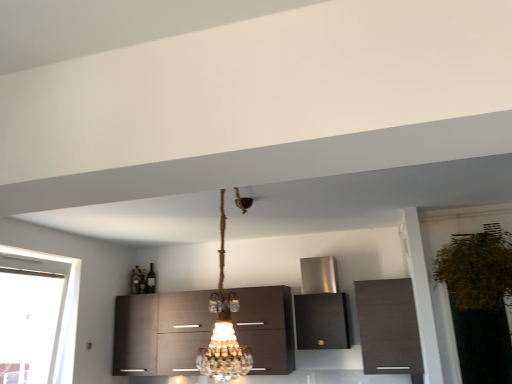
Question: Considering their positions, is clear glass window at left located in front of or behind crystal glass chandelier at center?

Choices:
 (A) behind
 (B) front

Answer: (A)

Question: From a real-world perspective, is clear glass window at left positioned above or below crystal glass chandelier at center?

Choices:
 (A) above
 (B) below

Answer: (B)

Question: Estimate the real-world distances between objects in this image. Which object is farther from the dark wood cabinet at center, marked as the third cabinetry in a right-to-left arrangement?

Choices:
 (A) stainless steel range hood at center, positioned as the 2th cabinetry in left-to-right order
 (B) green leafy plant at right
 (C) clear glass window at left
 (D) matte brown cabinet at upper right, the first cabinetry positioned from the right
 (E) crystal glass chandelier at center

Answer: (B)

Question: Considering the real-world distances, which object is farthest from the matte brown cabinet at upper right, the first cabinetry positioned from the right?

Choices:
 (A) clear glass window at left
 (B) crystal glass chandelier at center
 (C) green leafy plant at right
 (D) dark wood cabinet at center, marked as the third cabinetry in a right-to-left arrangement
 (E) stainless steel range hood at center, the 2th cabinetry positioned from the right

Answer: (A)